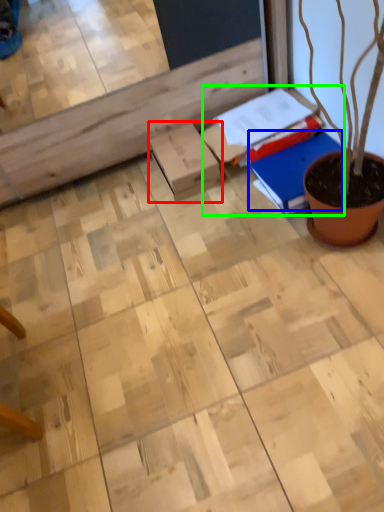
Question: Which object is positioned farthest from cardboard box (highlighted by a red box)? Select from notebook (highlighted by a blue box) and book (highlighted by a green box).

Choices:
 (A) notebook
 (B) book

Answer: (A)